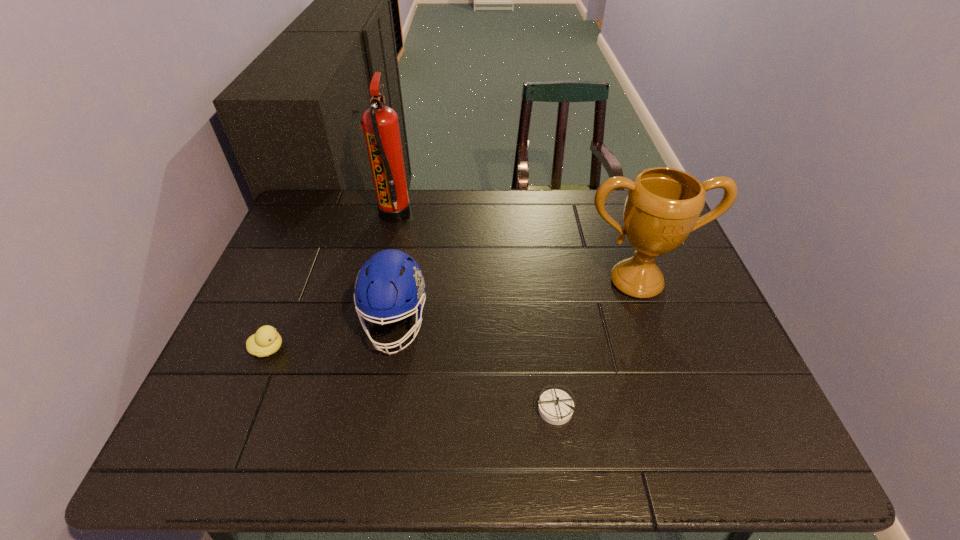
This screenshot has height=540, width=960. I want to click on free point located on the front of the award with the decoration, so click(667, 371).

Image resolution: width=960 pixels, height=540 pixels. Find the location of `vacant area located on the face guard of the third shortest object`. vacant area located on the face guard of the third shortest object is located at coordinates (379, 417).

Find the location of `free space located at the beak of the duckling`. free space located at the beak of the duckling is located at coordinates (391, 349).

You are a GUI agent. You are given a task and a screenshot of the screen. Output one action in this format:
    pyautogui.click(x=<x>, y=<y>)
    Task: Click on the free space located on the back of the compass
    
    Given the screenshot: What is the action you would take?
    [538, 281]

The width and height of the screenshot is (960, 540). In order to click on object at the far edge in this screenshot , I will do `click(380, 123)`.

Locate an element on the screen. The width and height of the screenshot is (960, 540). object at the near edge is located at coordinates (555, 406).

The width and height of the screenshot is (960, 540). Identify the location of object present at the left edge. (266, 341).

In order to click on object located at the right edge in this screenshot , I will do `click(663, 205)`.

Where is `free space at the far edge of the desktop`? The width and height of the screenshot is (960, 540). free space at the far edge of the desktop is located at coordinates (366, 228).

This screenshot has height=540, width=960. In order to click on vacant space at the near edge in this screenshot , I will do `click(668, 439)`.